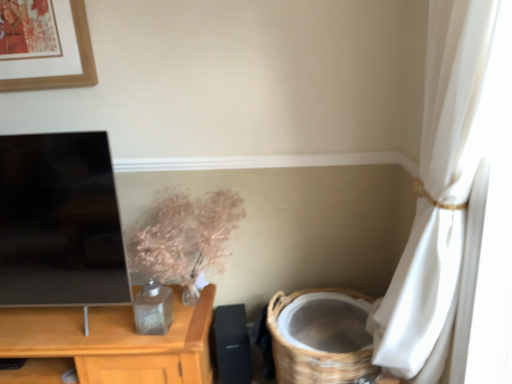
I want to click on black matte speaker at lower center, so click(x=232, y=344).

What do you see at coordinates (185, 235) in the screenshot? This screenshot has height=384, width=512. I see `metallic floral arrangement at center` at bounding box center [185, 235].

The height and width of the screenshot is (384, 512). In order to click on black matte speaker at lower center in this screenshot , I will do `click(232, 344)`.

From their relative heights in the image, would you say black matte speaker at lower center is taller or shorter than metallic floral arrangement at center?

In the image, black matte speaker at lower center appears to be shorter than metallic floral arrangement at center.

Is black matte speaker at lower center far away from metallic floral arrangement at center?

They are positioned close to each other.

Between point (224, 347) and point (165, 274), which one is positioned in front?

Point (165, 274)

Which is in front, metallic floral arrangement at center or woven brown basket at lower right?

woven brown basket at lower right is more forward.

Does metallic floral arrangement at center have a lesser width compared to woven brown basket at lower right?

Indeed, metallic floral arrangement at center has a lesser width compared to woven brown basket at lower right.

Is metallic floral arrangement at center shorter than woven brown basket at lower right?

Yes.

From the picture: Is metallic floral arrangement at center positioned with its back to woven brown basket at lower right?

No, metallic floral arrangement at center is not facing the opposite direction of woven brown basket at lower right.

Is point (343, 361) less distant than point (164, 228)?

That is True.

Is woven brown basket at lower right wider or thinner than metallic floral arrangement at center?

Considering their sizes, woven brown basket at lower right looks broader than metallic floral arrangement at center.

Locate an element on the screen. basket on the right of metallic floral arrangement at center is located at coordinates (313, 350).

Is metallic floral arrangement at center inside woven brown basket at lower right?

That's incorrect, metallic floral arrangement at center is not inside woven brown basket at lower right.

From a real-world perspective, is woven brown basket at lower right on black matte speaker at lower center?

Yes.

From the image's perspective, does woven brown basket at lower right appear lower than black matte speaker at lower center?

Incorrect, from the image's perspective, woven brown basket at lower right is higher than black matte speaker at lower center.

Between point (290, 356) and point (227, 341), which one is positioned behind?

Positioned behind is point (227, 341).

Does metallic floral arrangement at center come behind black matte speaker at lower center?

No.

From the image's perspective, between metallic floral arrangement at center and black matte speaker at lower center, which one is located above?

metallic floral arrangement at center, from the image's perspective.

The width and height of the screenshot is (512, 384). In order to click on floral arrangement to the left of black matte speaker at lower center in this screenshot , I will do `click(185, 235)`.

What's the angular difference between metallic floral arrangement at center and black matte speaker at lower center's facing directions?

They differ by 0.000285 degrees in their facing directions.

Which object is thinner, black matte speaker at lower center or woven brown basket at lower right?

black matte speaker at lower center.

Which object is positioned more to the left, black matte speaker at lower center or woven brown basket at lower right?

black matte speaker at lower center.

From a real-world perspective, which object rests below the other?

black matte speaker at lower center, from a real-world perspective.

Is black matte speaker at lower center bigger than woven brown basket at lower right?

No.

Where is `floral arrangement that appears above the black matte speaker at lower center (from a real-world perspective)`? The height and width of the screenshot is (384, 512). floral arrangement that appears above the black matte speaker at lower center (from a real-world perspective) is located at coordinates (185, 235).

In the image, there is a metallic floral arrangement at center. In order to click on basket below it (from a real-world perspective) in this screenshot , I will do tap(313, 350).

From the image, which object appears to be farther from metallic floral arrangement at center, woven brown basket at lower right or black matte speaker at lower center?

Based on the image, woven brown basket at lower right appears to be further to metallic floral arrangement at center.

When comparing their distances from woven brown basket at lower right, does metallic floral arrangement at center or black matte speaker at lower center seem further?

metallic floral arrangement at center is positioned further to the anchor woven brown basket at lower right.

Which object lies nearer to the anchor point black matte speaker at lower center, woven brown basket at lower right or metallic floral arrangement at center?

woven brown basket at lower right is positioned closer to the anchor black matte speaker at lower center.

Based on their spatial positions, is metallic floral arrangement at center or woven brown basket at lower right closer to black matte speaker at lower center?

Among the two, woven brown basket at lower right is located nearer to black matte speaker at lower center.

Considering their positions, is black matte speaker at lower center positioned further to woven brown basket at lower right than metallic floral arrangement at center?

The object further to woven brown basket at lower right is metallic floral arrangement at center.

In the scene shown: When comparing their distances from metallic floral arrangement at center, does black matte speaker at lower center or woven brown basket at lower right seem closer?

black matte speaker at lower center lies closer to metallic floral arrangement at center than the other object.

The image size is (512, 384). Identify the location of speaker between metallic floral arrangement at center and woven brown basket at lower right. (232, 344).